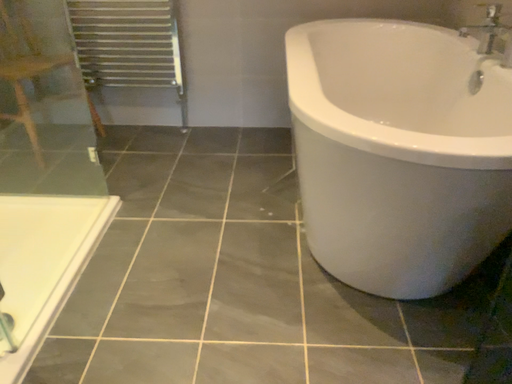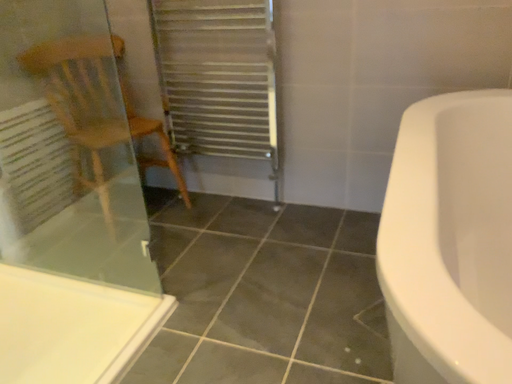
Question: How did the camera likely rotate when shooting the video?

Choices:
 (A) rotated left
 (B) rotated right

Answer: (A)